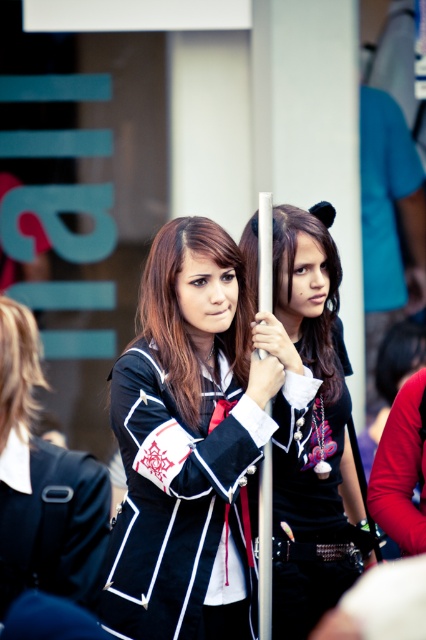
You are a photographer trying to capture a candid shot of both individuals in the scene. You notice two points marked in the image, point (276, 220) and point (46, 465). Which point is closer to your camera lens when taking the photo?

Point (276, 220) is further to the viewer than point (46, 465), so the point closer to the camera lens would be point (276, 220).

You are a fashion designer analyzing a photo of two people wearing jackets. The photo shows a black satin cosplay jacket at center and a black matte jacket at center. Which jacket is positioned lower on the body?

The black satin cosplay jacket at center is below the black matte jacket at center, so it is positioned lower on the body.